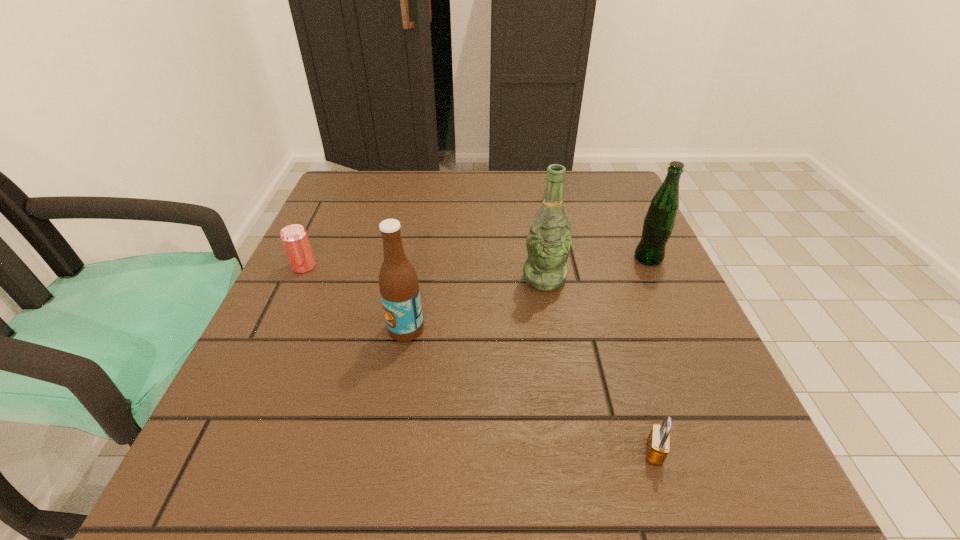
Identify the location of free space at the right edge of the desktop. (668, 276).

I want to click on blank space at the far left corner of the desktop, so point(344,207).

At what (x,y) coordinates should I click in order to perform the action: click on free region at the near left corner of the desktop. Please return your answer as a coordinate pair (x, y). Looking at the image, I should click on (277, 484).

This screenshot has height=540, width=960. I want to click on free location at the far right corner, so click(641, 213).

I want to click on blank space at the near right corner of the desktop, so point(780,517).

At what (x,y) coordinates should I click in order to perform the action: click on free space between the second beer bottle from left to right and the rightmost beer bottle. Please return your answer as a coordinate pair (x, y). Looking at the image, I should click on (596, 268).

The width and height of the screenshot is (960, 540). I want to click on blank region between the third object from left to right and the beer can, so click(424, 272).

Find the location of a particular element. This screenshot has height=540, width=960. vacant space in between the second beer bottle from right to left and the leftmost object is located at coordinates (424, 272).

Find the location of a particular element. Image resolution: width=960 pixels, height=540 pixels. blank region between the rightmost beer bottle and the leftmost object is located at coordinates (476, 262).

Image resolution: width=960 pixels, height=540 pixels. I want to click on free space between the rightmost beer bottle and the second object from left to right, so click(x=527, y=294).